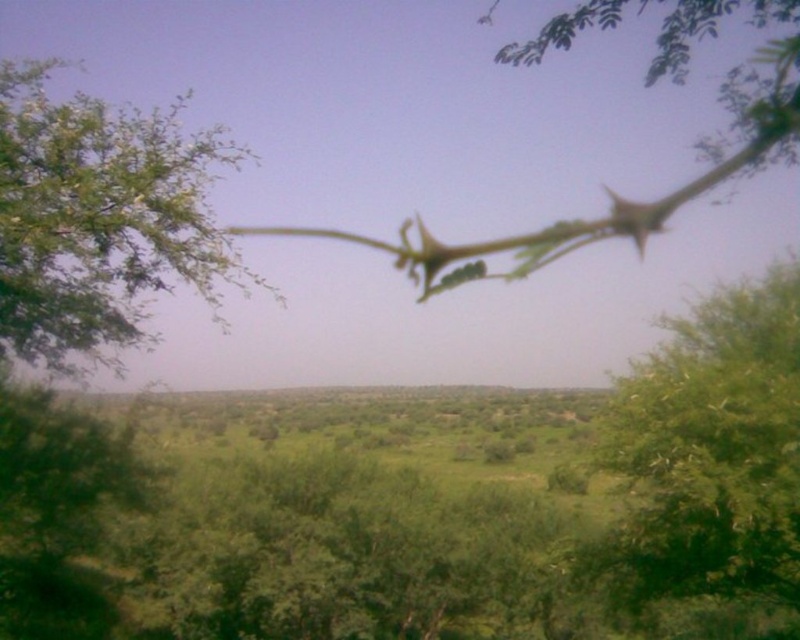
Question: Does green leafy tree at center have a smaller size compared to green leafy tree at upper left?

Choices:
 (A) no
 (B) yes

Answer: (B)

Question: Does green leafy tree at center have a greater width compared to green leafy tree at upper left?

Choices:
 (A) no
 (B) yes

Answer: (A)

Question: Does green leafy tree at center appear on the left side of green leafy tree at upper left?

Choices:
 (A) yes
 (B) no

Answer: (B)

Question: Which object is closer to the camera taking this photo?

Choices:
 (A) green leafy tree at center
 (B) green leafy tree at upper left

Answer: (B)